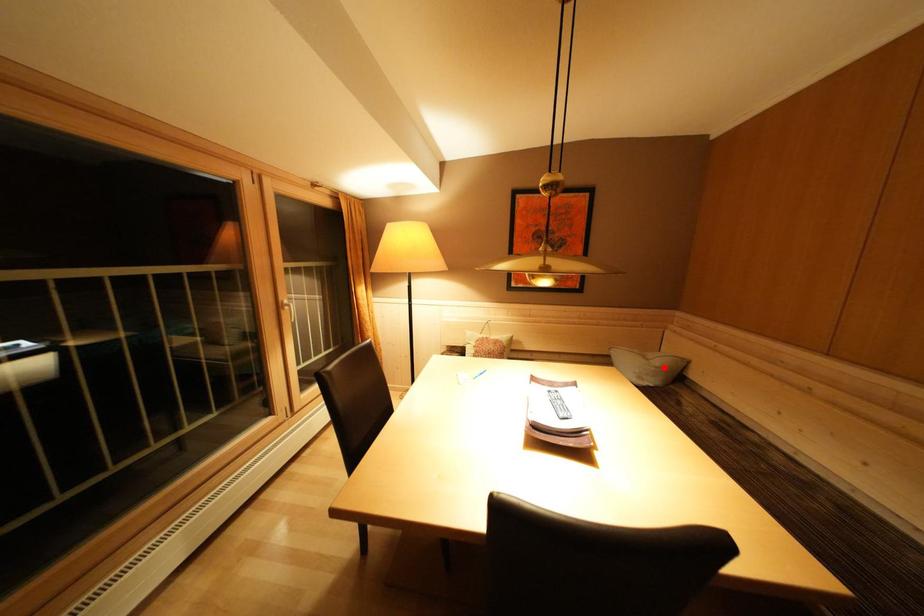
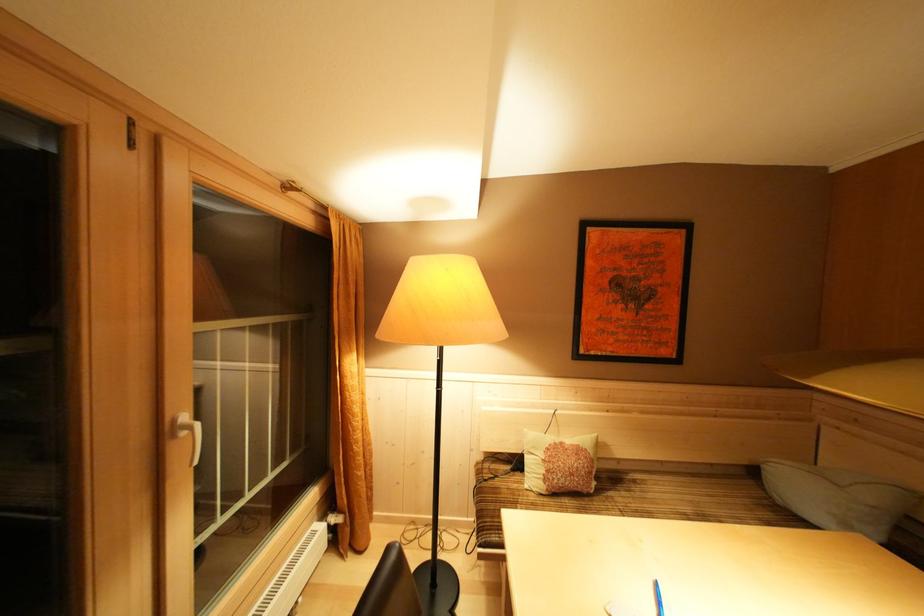
Question: A red point is marked in image1. In image2, is the corresponding 3D point closer to the camera or farther? Reply with the corresponding letter.

Choices:
 (A) The corresponding 3D point is closer.
 (B) The corresponding 3D point is farther.

Answer: (A)